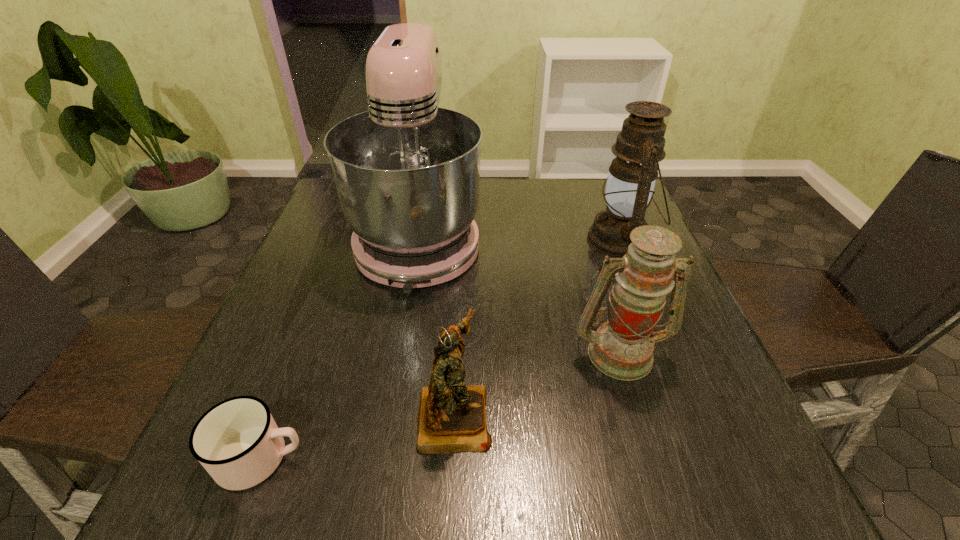
Find the location of a particular element. The width and height of the screenshot is (960, 540). mixer is located at coordinates (407, 172).

This screenshot has width=960, height=540. Identify the location of the farther oil lamp. (630, 184).

You are a GUI agent. You are given a task and a screenshot of the screen. Output one action in this format:
    pyautogui.click(x=<x>, y=<y>)
    Task: Click on the taller oil lamp
    Image resolution: width=960 pixels, height=540 pixels.
    Given the screenshot: What is the action you would take?
    pyautogui.click(x=630, y=184)

Find the location of a particular element. This screenshot has height=540, width=960. the third farthest object is located at coordinates (622, 348).

Locate an element on the screen. the third shortest object is located at coordinates (622, 348).

The image size is (960, 540). In order to click on the second shortest object in this screenshot , I will do `click(452, 418)`.

You are a GUI agent. You are given a task and a screenshot of the screen. Output one action in this format:
    pyautogui.click(x=<x>, y=<y>)
    Task: Click on the mug
    
    Given the screenshot: What is the action you would take?
    pyautogui.click(x=237, y=441)

Locate an element on the screen. free region located 0.320m on the front-facing side of the tallest object is located at coordinates (x=384, y=438).

Locate an element on the screen. This screenshot has height=540, width=960. free space located on the left of the taller oil lamp is located at coordinates (534, 239).

Where is `free space located 0.150m on the back of the third tallest object`? Image resolution: width=960 pixels, height=540 pixels. free space located 0.150m on the back of the third tallest object is located at coordinates (597, 278).